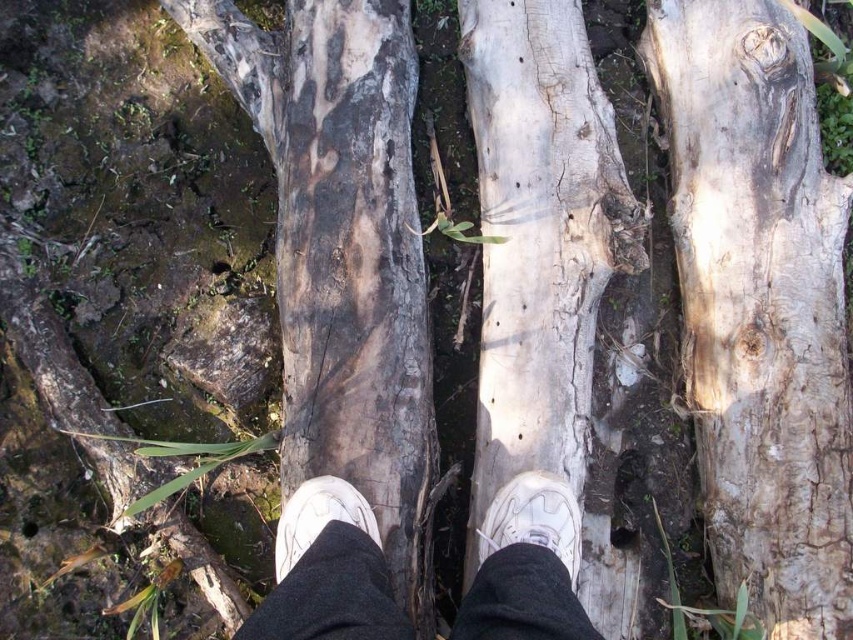
Question: Which object appears farthest from the camera in this image?

Choices:
 (A) dark gray bark at center
 (B) white leather shoe at center

Answer: (A)

Question: Which of these objects is positioned closest to the white matte sneakers at center?

Choices:
 (A) white cracked wood at center
 (B) dark gray bark at center
 (C) white leather shoe at center
 (D) light brown rough bark at right

Answer: (C)

Question: Does light brown rough bark at right appear on the right side of white matte sneakers at center?

Choices:
 (A) yes
 (B) no

Answer: (A)

Question: Is light brown rough bark at right smaller than white cracked wood at center?

Choices:
 (A) yes
 (B) no

Answer: (B)

Question: Estimate the real-world distances between objects in this image. Which object is closer to the white cracked wood at center?

Choices:
 (A) white matte sneakers at center
 (B) light brown rough bark at right
 (C) dark gray bark at center

Answer: (C)

Question: Is light brown rough bark at right wider than white matte shoe at center?

Choices:
 (A) yes
 (B) no

Answer: (A)